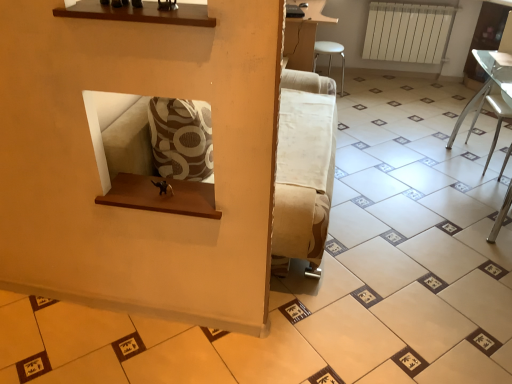
Question: Can you confirm if white fabric armchair at lower right is wider than clear glass table at right, which is the 1th furniture in right-to-left order?

Choices:
 (A) no
 (B) yes

Answer: (B)

Question: From a real-world perspective, is white fabric armchair at lower right positioned over clear glass table at right, which is the 1th furniture in right-to-left order, based on gravity?

Choices:
 (A) no
 (B) yes

Answer: (B)

Question: Considering the relative sizes of white fabric armchair at lower right and clear glass table at right, marked as the 2th furniture in a top-to-bottom arrangement, in the image provided, is white fabric armchair at lower right taller than clear glass table at right, marked as the 2th furniture in a top-to-bottom arrangement,?

Choices:
 (A) yes
 (B) no

Answer: (A)

Question: Is white fabric armchair at lower right positioned with its back to clear glass table at right, which appears as the 1th furniture when ordered from the bottom?

Choices:
 (A) yes
 (B) no

Answer: (A)

Question: Is white fabric armchair at lower right positioned behind clear glass table at right, placed as the 2th furniture when sorted from back to front?

Choices:
 (A) yes
 (B) no

Answer: (A)

Question: Are white fabric armchair at lower right and clear glass table at right, acting as the 2th furniture starting from the left, making contact?

Choices:
 (A) no
 (B) yes

Answer: (A)

Question: Can you confirm if white fabric armchair at lower right is bigger than white plastic stool at upper right, which appears as the 1th furniture when viewed from the left?

Choices:
 (A) no
 (B) yes

Answer: (B)

Question: Is white plastic stool at upper right, which ranks as the 2th furniture in bottom-to-top order, at the back of white fabric armchair at lower right?

Choices:
 (A) yes
 (B) no

Answer: (B)

Question: Is white fabric armchair at lower right surrounding white plastic stool at upper right, positioned as the 2th furniture in front-to-back order?

Choices:
 (A) yes
 (B) no

Answer: (B)

Question: Can we say white fabric armchair at lower right lies outside white plastic stool at upper right, positioned as the 2th furniture in front-to-back order?

Choices:
 (A) yes
 (B) no

Answer: (A)

Question: Is white fabric armchair at lower right with white plastic stool at upper right, which ranks as the 2th furniture in right-to-left order?

Choices:
 (A) no
 (B) yes

Answer: (A)

Question: Considering the relative sizes of white fabric armchair at lower right and white plastic stool at upper right, which ranks as the 2th furniture in right-to-left order, in the image provided, is white fabric armchair at lower right wider than white plastic stool at upper right, which ranks as the 2th furniture in right-to-left order,?

Choices:
 (A) no
 (B) yes

Answer: (B)

Question: Considering the relative sizes of white fabric armchair at lower right and white matte radiator at upper right in the image provided, is white fabric armchair at lower right smaller than white matte radiator at upper right?

Choices:
 (A) yes
 (B) no

Answer: (B)